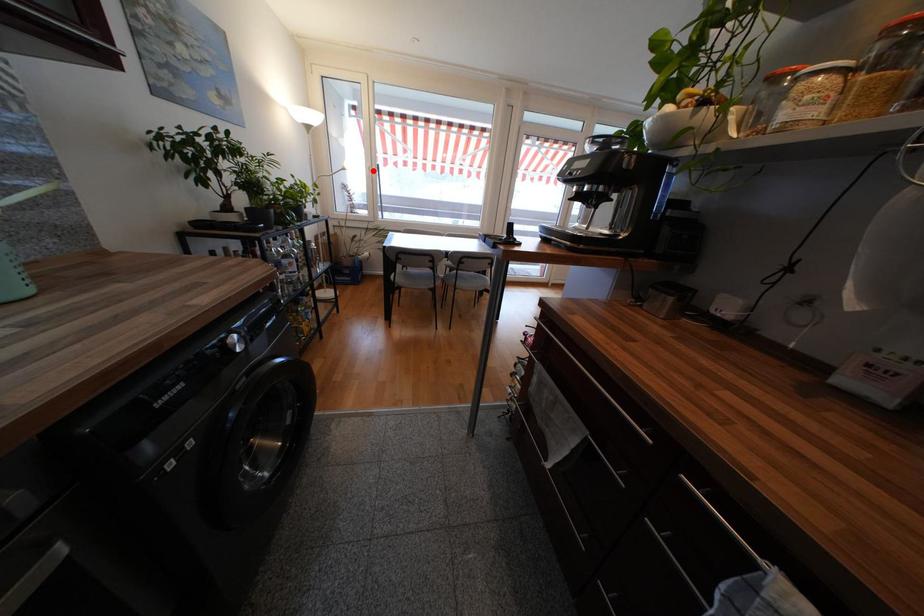
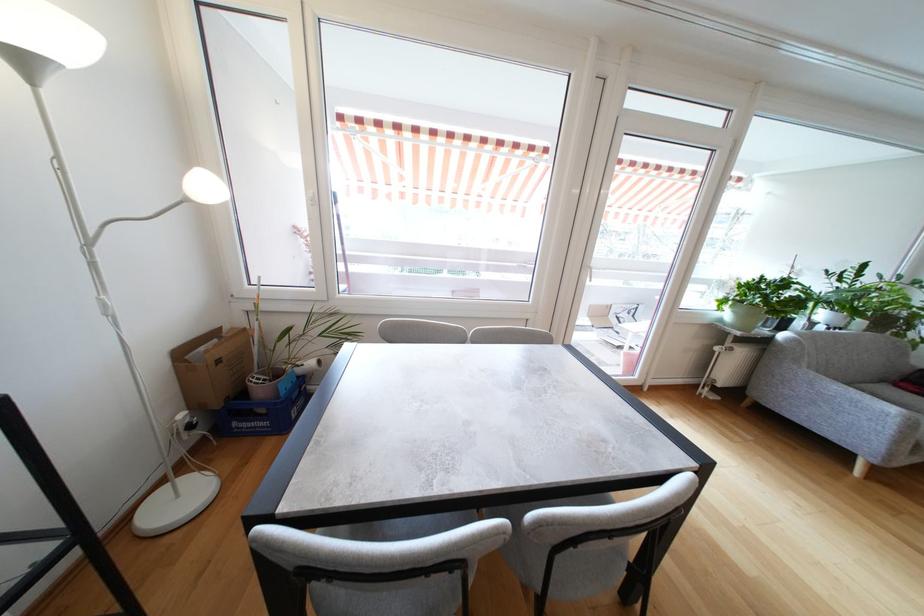
The point at the highlighted location is marked in the first image. Where is the corresponding point in the second image?

(315, 201)